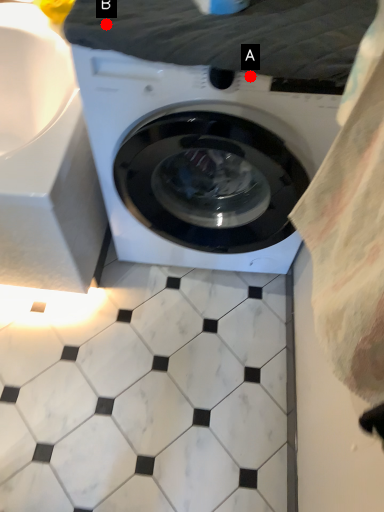
Question: Two points are circled on the image, labeled by A and B beside each circle. Among these points, which one is nearest to the camera?

Choices:
 (A) A is closer
 (B) B is closer

Answer: (B)